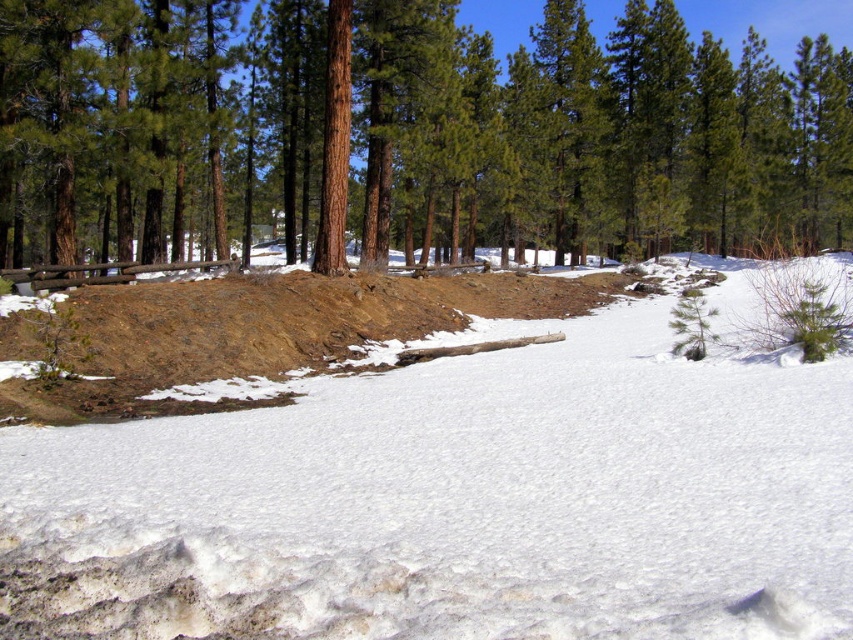
Question: Does white fluffy snow at center have a larger size compared to brown textured log at center?

Choices:
 (A) no
 (B) yes

Answer: (A)

Question: Does white fluffy snow at center have a greater width compared to brown textured log at center?

Choices:
 (A) yes
 (B) no

Answer: (B)

Question: Which of the following is the closest to the observer?

Choices:
 (A) white fluffy snow at center
 (B) brown textured log at center

Answer: (A)

Question: Is white fluffy snow at center closer to the viewer compared to brown textured log at center?

Choices:
 (A) yes
 (B) no

Answer: (A)